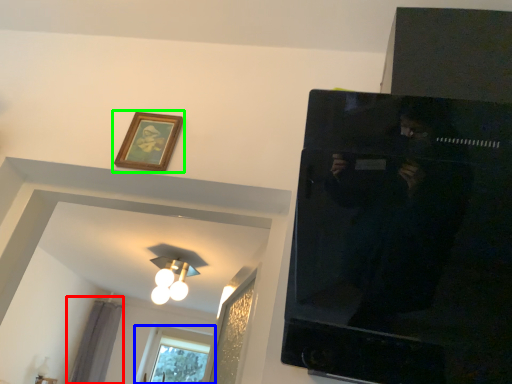
Question: Which object is positioned farthest from curtain (highlighted by a red box)? Select from window (highlighted by a blue box) and picture frame (highlighted by a green box).

Choices:
 (A) window
 (B) picture frame

Answer: (B)